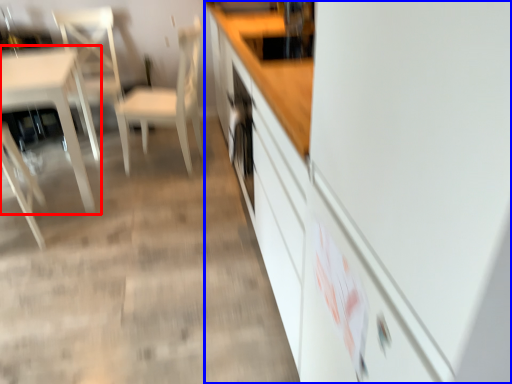
Question: Which point is further to the camera, table (highlighted by a red box) or cabinetry (highlighted by a blue box)?

Choices:
 (A) table
 (B) cabinetry

Answer: (A)